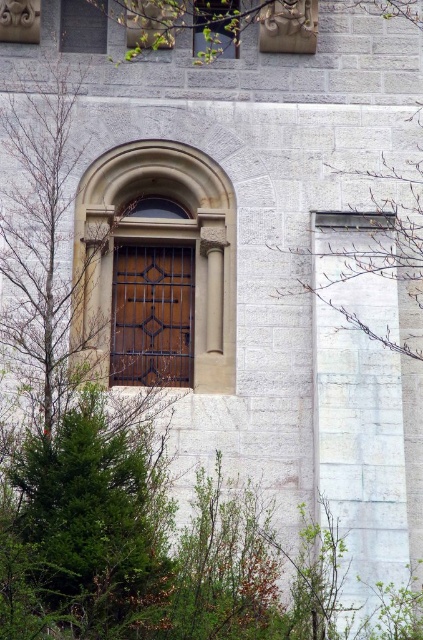
You are an architect analyzing the building facade. You notice the green leafy tree at center and the matte glass window at upper center. Which object occupies more space on the facade?

The green leafy tree at center is larger in size than the matte glass window at upper center, so it occupies more space on the facade.

What is the spatial relationship between the matte wood window at upper center and the matte glass window at upper center in the stone building?

The matte wood window at upper center is located below the matte glass window at upper center.